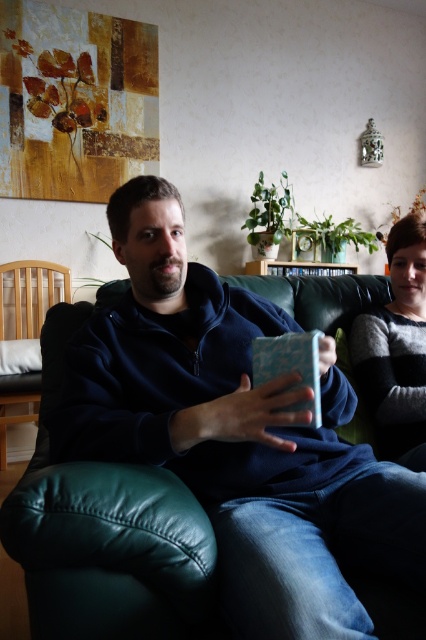
You are planning to hang a picture frame that requires a support height of 1.5 meters. You see the striped sweater at right and the light brown wooden chair at left in the scene. Which object is more suitable for placing the frame based on their height?

The light brown wooden chair at left is taller than the striped sweater at right, so the frame should be placed on the light brown wooden chair at left since it meets the required height of 1.5 meters.

In the scene shown: You are planning to host a small gathering and need to seat two guests. The green leather couch at center and the light brown wooden chair at left are available. Which piece of furniture can accommodate more people?

The green leather couch at center can accommodate more people because its width is larger than the light brown wooden chair at left.